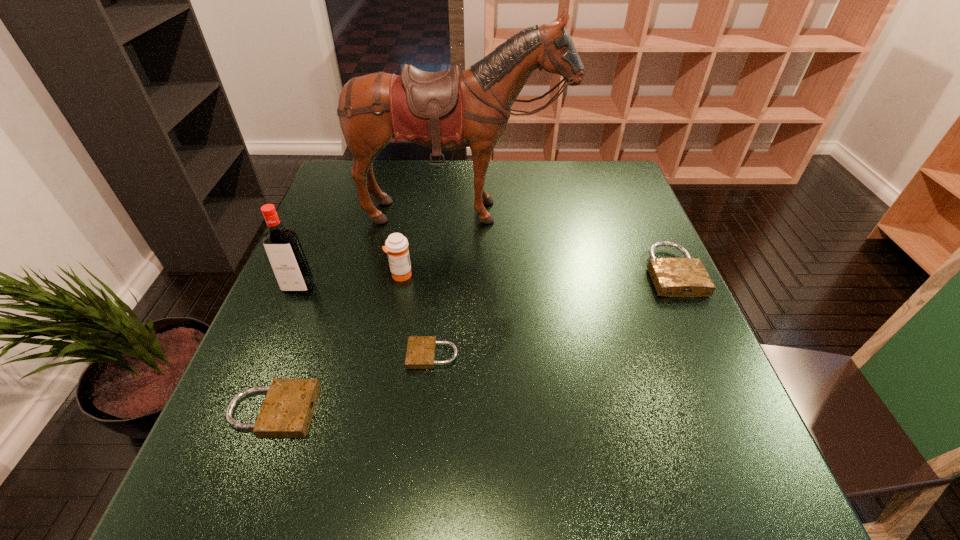
Locate an element on the screen. The image size is (960, 540). the second tallest padlock is located at coordinates (288, 407).

The height and width of the screenshot is (540, 960). Find the location of `the nearest padlock`. the nearest padlock is located at coordinates point(288,407).

The height and width of the screenshot is (540, 960). I want to click on the shortest object, so click(421, 350).

At what (x,y) coordinates should I click in order to perform the action: click on the second padlock from left to right. Please return your answer as a coordinate pair (x, y). Looking at the image, I should click on [421, 350].

Locate an element on the screen. The width and height of the screenshot is (960, 540). the rightmost padlock is located at coordinates tap(673, 277).

Identify the location of the rightmost object. (673, 277).

Image resolution: width=960 pixels, height=540 pixels. I want to click on the farthest object, so (x=448, y=110).

Locate an element on the screen. The image size is (960, 540). the tallest object is located at coordinates (448, 110).

Identify the location of medicine. The width and height of the screenshot is (960, 540). (396, 246).

Where is `the second tallest object`? The image size is (960, 540). the second tallest object is located at coordinates (287, 259).